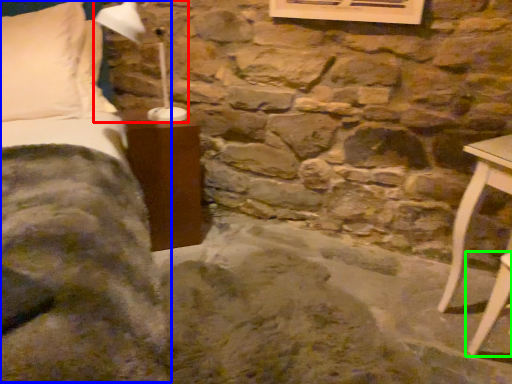
Question: Considering the real-world distances, which object is farthest from table lamp (highlighted by a red box)? bed (highlighted by a blue box) or furniture (highlighted by a green box)?

Choices:
 (A) bed
 (B) furniture

Answer: (B)